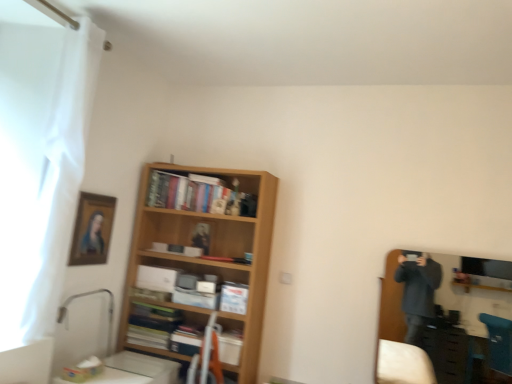
Question: Considering the positions of point (138, 306) and point (104, 206), is point (138, 306) closer or farther from the camera than point (104, 206)?

Choices:
 (A) closer
 (B) farther

Answer: (B)

Question: Considering the positions of matte orange bookshelf at center, arranged as the 1th book when viewed from the front, and wooden framed portrait at upper left in the image, is matte orange bookshelf at center, arranged as the 1th book when viewed from the front, bigger or smaller than wooden framed portrait at upper left?

Choices:
 (A) small
 (B) big

Answer: (B)

Question: Estimate the real-world distances between objects in this image. Which object is closer to the wooden framed portrait at upper left?

Choices:
 (A) wooden bookshelf at center, positioned as the 1th book in back-to-front order
 (B) matte orange bookshelf at center, marked as the first book in a bottom-to-top arrangement
 (C) wooden bookshelf at center
 (D) wooden entertainment center at right
 (E) white sheer curtain at left

Answer: (E)

Question: Which object is positioned farthest from the white sheer curtain at left?

Choices:
 (A) matte orange bookshelf at center, arranged as the 1th book when viewed from the front
 (B) wooden bookshelf at center, which is the second book in bottom-to-top order
 (C) wooden framed portrait at upper left
 (D) wooden entertainment center at right
 (E) wooden bookshelf at center

Answer: (D)